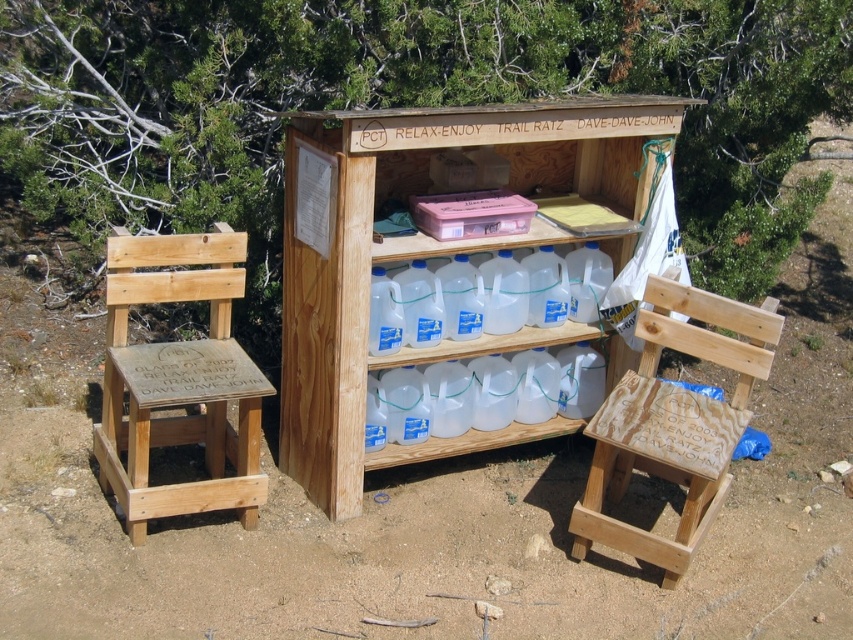
You are a hiker who just arrived at the water station. You need to take a photo of the sign on the front of the structure. You have a camera that can focus up to 10 feet away. The natural wood step stool at left is next to you. Can you reach the sign without moving the stool?

The natural wood step stool at left and camera are 9.64 feet apart, so yes, the camera can focus on the sign since the distance is within its 10 feet range.

What is the spatial relationship between the wooden at center and the natural wood step stool at left?

The natural wood step stool at left is behind the wooden at center.